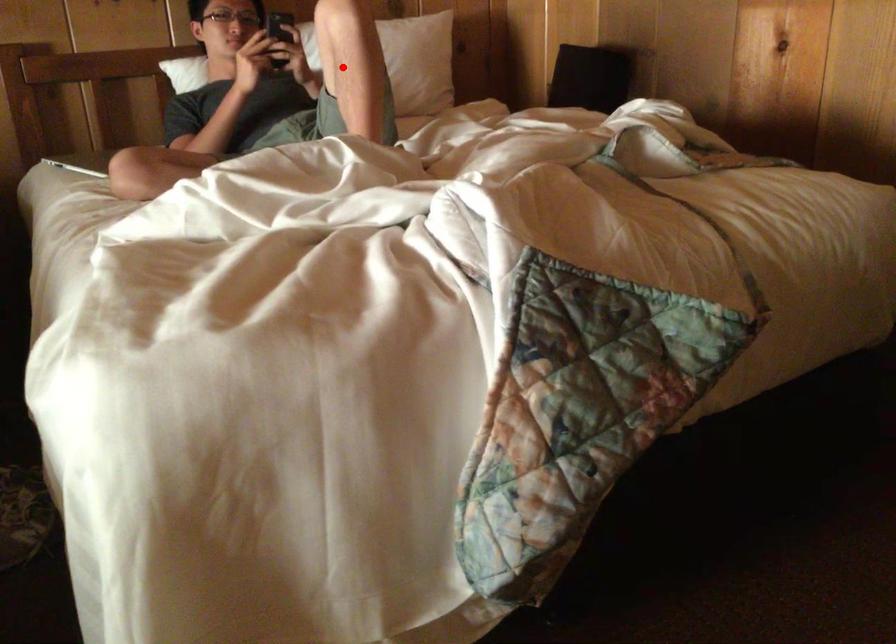
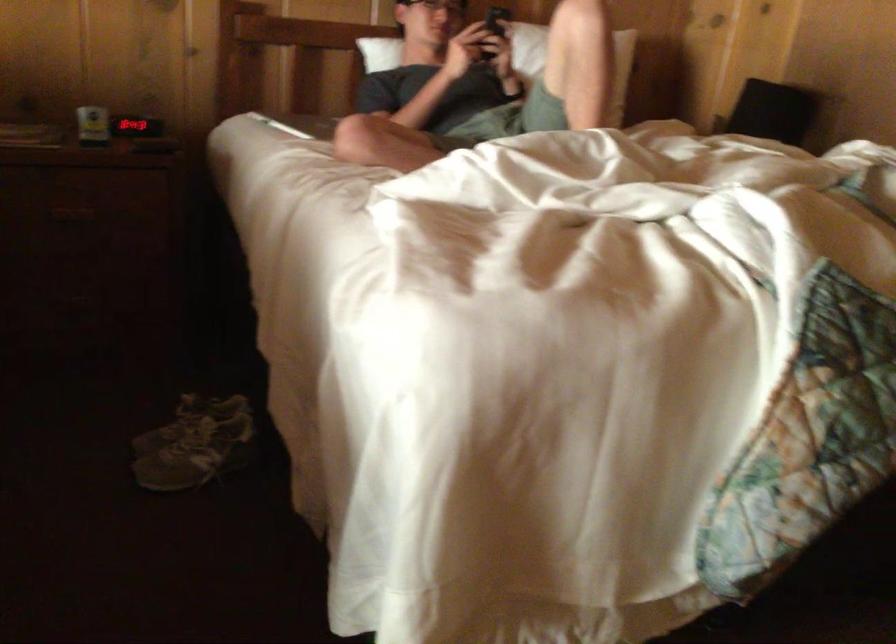
The point at the highlighted location is marked in the first image. Where is the corresponding point in the second image?

(573, 61)